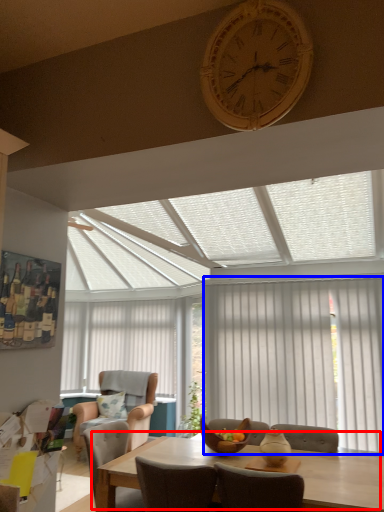
Question: Which object is further to the camera taking this photo, kitchen & dining room table (highlighted by a red box) or curtain (highlighted by a blue box)?

Choices:
 (A) kitchen & dining room table
 (B) curtain

Answer: (B)